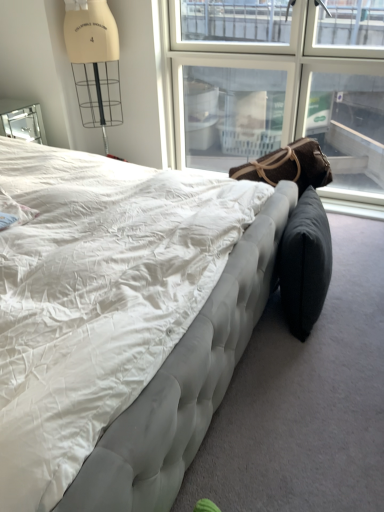
Question: Does transparent glass window at upper right appear on the right side of tufted fabric bed at center?

Choices:
 (A) no
 (B) yes

Answer: (B)

Question: Is transparent glass window at upper right bigger than tufted fabric bed at center?

Choices:
 (A) yes
 (B) no

Answer: (B)

Question: From the image's perspective, is transparent glass window at upper right located beneath tufted fabric bed at center?

Choices:
 (A) yes
 (B) no

Answer: (B)

Question: Is transparent glass window at upper right not within tufted fabric bed at center?

Choices:
 (A) yes
 (B) no

Answer: (A)

Question: Considering the relative positions of transparent glass window at upper right and tufted fabric bed at center in the image provided, is transparent glass window at upper right to the left of tufted fabric bed at center from the viewer's perspective?

Choices:
 (A) yes
 (B) no

Answer: (B)

Question: Considering the positions of black fabric bean bag chair at lower right, the 2th bean bag chair from the top, and tufted fabric bed at center in the image, is black fabric bean bag chair at lower right, the 2th bean bag chair from the top, wider or thinner than tufted fabric bed at center?

Choices:
 (A) wide
 (B) thin

Answer: (B)

Question: Is black fabric bean bag chair at lower right, the 2th bean bag chair from the top, inside the boundaries of tufted fabric bed at center, or outside?

Choices:
 (A) outside
 (B) inside

Answer: (A)

Question: From a real-world perspective, is black fabric bean bag chair at lower right, arranged as the first bean bag chair when ordered from the bottom, above or below tufted fabric bed at center?

Choices:
 (A) below
 (B) above

Answer: (A)

Question: Relative to tufted fabric bed at center, is black fabric bean bag chair at lower right, arranged as the first bean bag chair when ordered from the bottom, in front or behind?

Choices:
 (A) front
 (B) behind

Answer: (B)

Question: Considering the positions of black fabric bean bag chair at lower right, arranged as the first bean bag chair when ordered from the bottom, and transparent glass window at upper right in the image, is black fabric bean bag chair at lower right, arranged as the first bean bag chair when ordered from the bottom, wider or thinner than transparent glass window at upper right?

Choices:
 (A) wide
 (B) thin

Answer: (B)

Question: Visually, is black fabric bean bag chair at lower right, the 2th bean bag chair from the top, positioned to the left or to the right of transparent glass window at upper right?

Choices:
 (A) left
 (B) right

Answer: (B)

Question: From a real-world perspective, is black fabric bean bag chair at lower right, the 2th bean bag chair from the top, positioned above or below transparent glass window at upper right?

Choices:
 (A) below
 (B) above

Answer: (A)

Question: From the image's perspective, is black fabric bean bag chair at lower right, the 2th bean bag chair from the top, located above or below transparent glass window at upper right?

Choices:
 (A) above
 (B) below

Answer: (B)

Question: From the image's perspective, relative to brown fabric bean bag at center, which ranks as the second bean bag chair in bottom-to-top order, is tufted fabric bed at center above or below?

Choices:
 (A) below
 (B) above

Answer: (A)

Question: Looking at their shapes, would you say tufted fabric bed at center is wider or thinner than brown fabric bean bag at center, the 1th bean bag chair viewed from the top?

Choices:
 (A) thin
 (B) wide

Answer: (B)